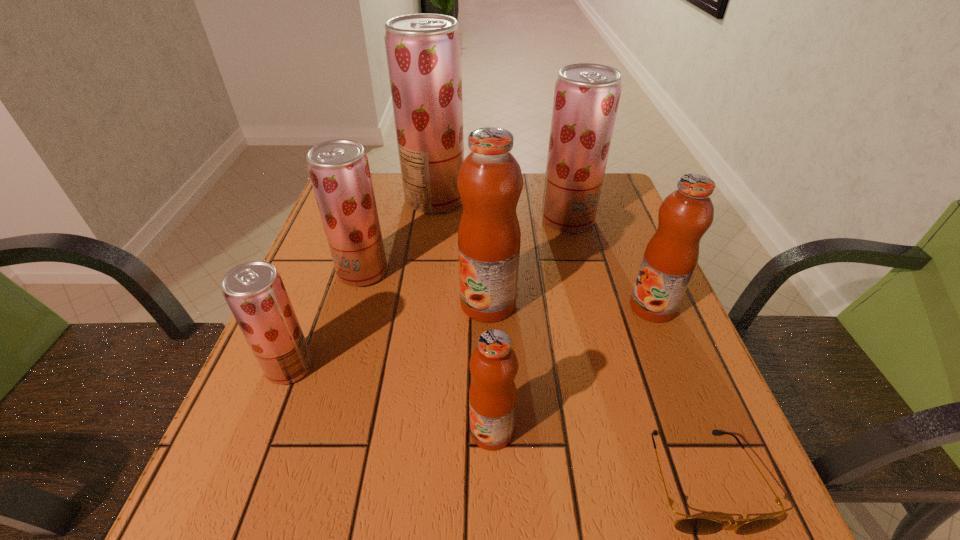
Locate an element on the screen. The height and width of the screenshot is (540, 960). free space located 0.210m on the front label of the rightmost fruit juice is located at coordinates (531, 307).

You are a GUI agent. You are given a task and a screenshot of the screen. Output one action in this format:
    pyautogui.click(x=<x>, y=<y>)
    Task: Click on the free space located on the front label of the rightmost fruit juice
    Image resolution: width=960 pixels, height=540 pixels.
    Given the screenshot: What is the action you would take?
    pyautogui.click(x=479, y=307)

The height and width of the screenshot is (540, 960). In order to click on blank space located 0.370m on the front label of the rightmost fruit juice in this screenshot , I will do `click(455, 307)`.

This screenshot has height=540, width=960. In order to click on blank space located on the front of the third nearest object in this screenshot , I will do `click(245, 484)`.

Locate an element on the screen. This screenshot has width=960, height=540. vacant space located on the front label of the smallest orange fruit juice is located at coordinates (251, 431).

You are a GUI agent. You are given a task and a screenshot of the screen. Output one action in this format:
    pyautogui.click(x=<x>, y=<y>)
    Task: Click on the vacant space located 0.080m on the front label of the smallest orange fruit juice
    This screenshot has height=540, width=960.
    Given the screenshot: What is the action you would take?
    pyautogui.click(x=421, y=431)

Where is `free space located on the front label of the smallest orange fruit juice`? This screenshot has height=540, width=960. free space located on the front label of the smallest orange fruit juice is located at coordinates click(251, 431).

Find the location of a particular element. object positioned at the near edge is located at coordinates (693, 525).

Where is `sunglasses present at the right edge`? This screenshot has height=540, width=960. sunglasses present at the right edge is located at coordinates (693, 525).

The height and width of the screenshot is (540, 960). Identify the location of object at the far right corner. (586, 98).